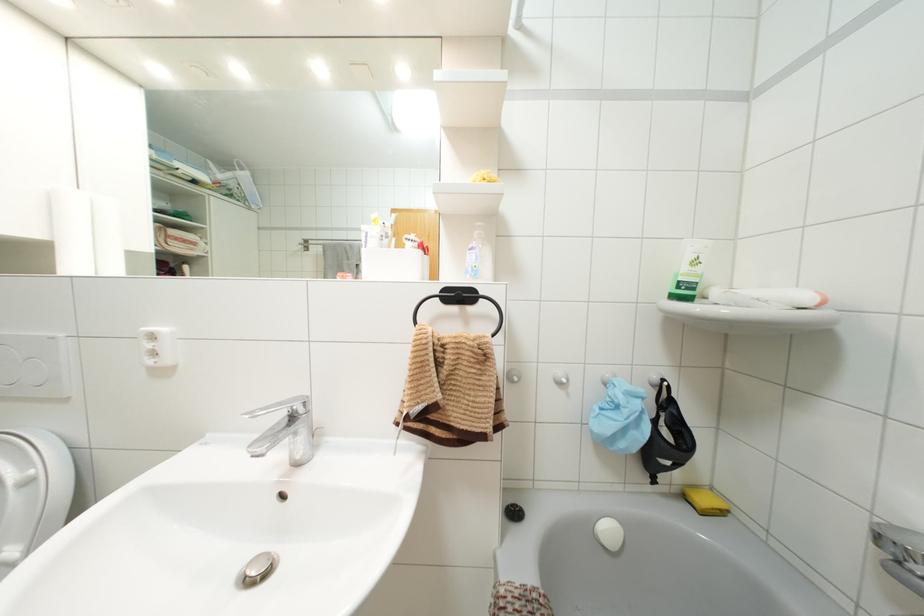
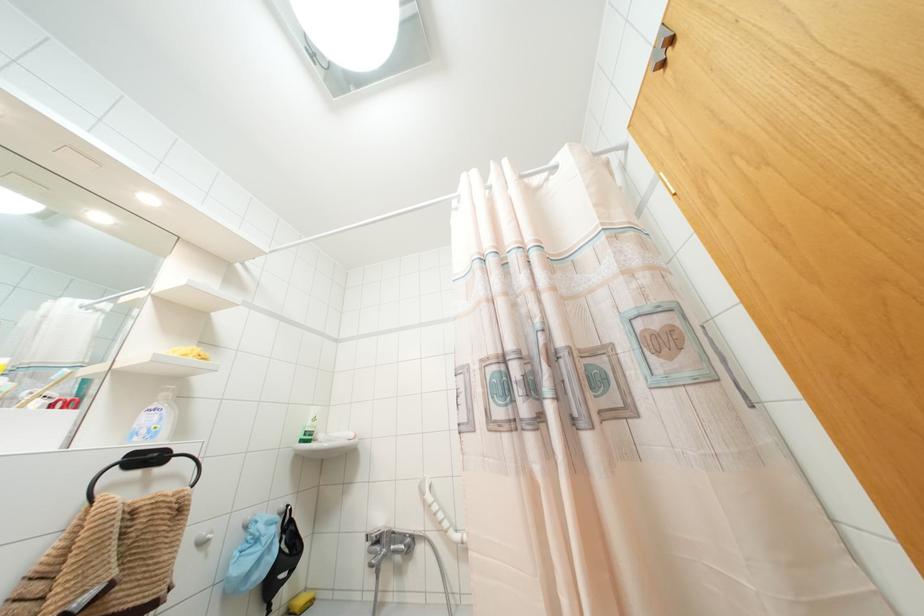
The point at (x=458, y=294) is marked in the first image. Where is the corresponding point in the second image?

(147, 458)